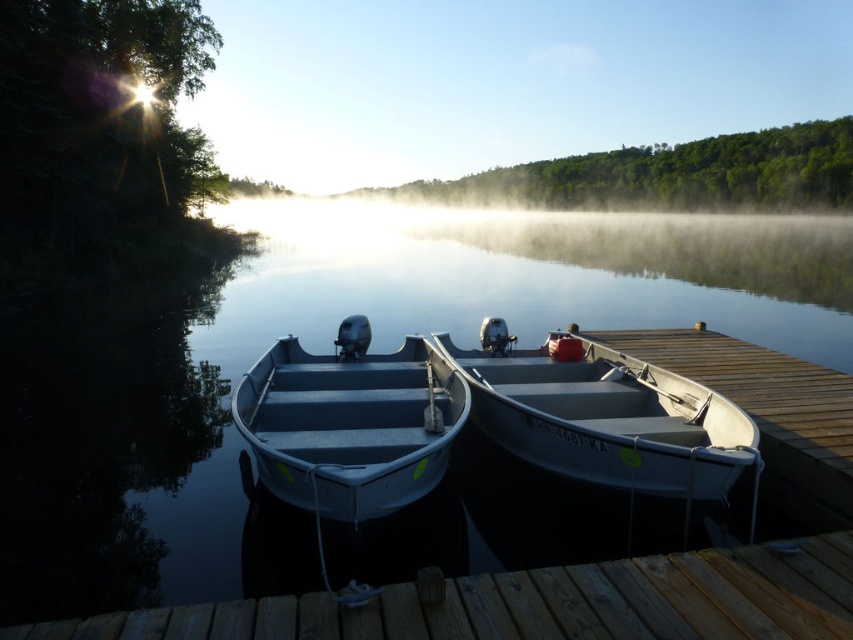
Does wooden dock at center have a lesser width compared to metallic gray canoe at center?

In fact, wooden dock at center might be wider than metallic gray canoe at center.

The width and height of the screenshot is (853, 640). What do you see at coordinates (543, 604) in the screenshot?
I see `wooden dock at center` at bounding box center [543, 604].

Image resolution: width=853 pixels, height=640 pixels. Identify the location of wooden dock at center. (543, 604).

Does clear water at center have a larger size compared to gray metallic canoe at center?

Indeed, clear water at center has a larger size compared to gray metallic canoe at center.

Who is more distant from viewer, [492,253] or [489,358]?

Positioned behind is point [492,253].

You are a GUI agent. You are given a task and a screenshot of the screen. Output one action in this format:
    pyautogui.click(x=<x>, y=<y>)
    Task: Click on the clear water at center
    The image size is (853, 640).
    Given the screenshot: What is the action you would take?
    [x=329, y=349]

Does gray metallic canoe at center have a greater height compared to metallic gray canoe at center?

Incorrect, gray metallic canoe at center's height is not larger of metallic gray canoe at center's.

Between point (584, 481) and point (351, 339), which one is positioned in front?

Point (584, 481)

Which is in front, point (602, 372) or point (267, 385)?

Point (267, 385) is more forward.

In order to click on gray metallic canoe at center in this screenshot , I will do point(605,417).